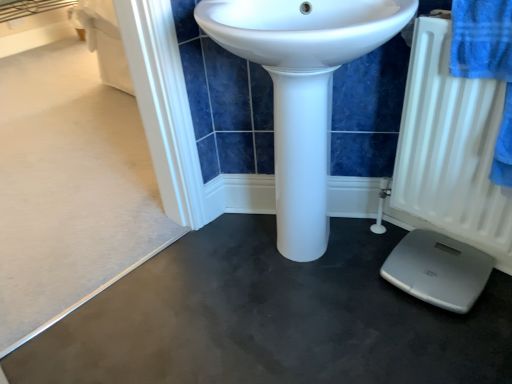
Question: From a real-world perspective, is white matte radiator at right below white glossy sink at center?

Choices:
 (A) yes
 (B) no

Answer: (B)

Question: Does white matte radiator at right come in front of white glossy sink at center?

Choices:
 (A) yes
 (B) no

Answer: (B)

Question: Can white glossy sink at center be found inside white matte radiator at right?

Choices:
 (A) yes
 (B) no

Answer: (B)

Question: Does white matte radiator at right have a smaller size compared to white glossy sink at center?

Choices:
 (A) yes
 (B) no

Answer: (A)

Question: Is white matte radiator at right touching white glossy sink at center?

Choices:
 (A) no
 (B) yes

Answer: (A)

Question: From the image's perspective, is white matte radiator at right on white glossy sink at center?

Choices:
 (A) no
 (B) yes

Answer: (A)

Question: Is white glossy sink at center oriented towards white matte radiator at right?

Choices:
 (A) yes
 (B) no

Answer: (B)

Question: From the image's perspective, is white glossy sink at center under white matte radiator at right?

Choices:
 (A) yes
 (B) no

Answer: (B)

Question: Does white glossy sink at center have a lesser width compared to white matte radiator at right?

Choices:
 (A) no
 (B) yes

Answer: (A)

Question: Is white glossy sink at center beside white matte radiator at right?

Choices:
 (A) no
 (B) yes

Answer: (A)

Question: From the image's perspective, is white glossy sink at center on top of white matte radiator at right?

Choices:
 (A) no
 (B) yes

Answer: (B)

Question: Can you confirm if white glossy sink at center is shorter than white matte radiator at right?

Choices:
 (A) yes
 (B) no

Answer: (B)

Question: From the image's perspective, relative to white glossy sink at center, is white matte radiator at right above or below?

Choices:
 (A) above
 (B) below

Answer: (B)